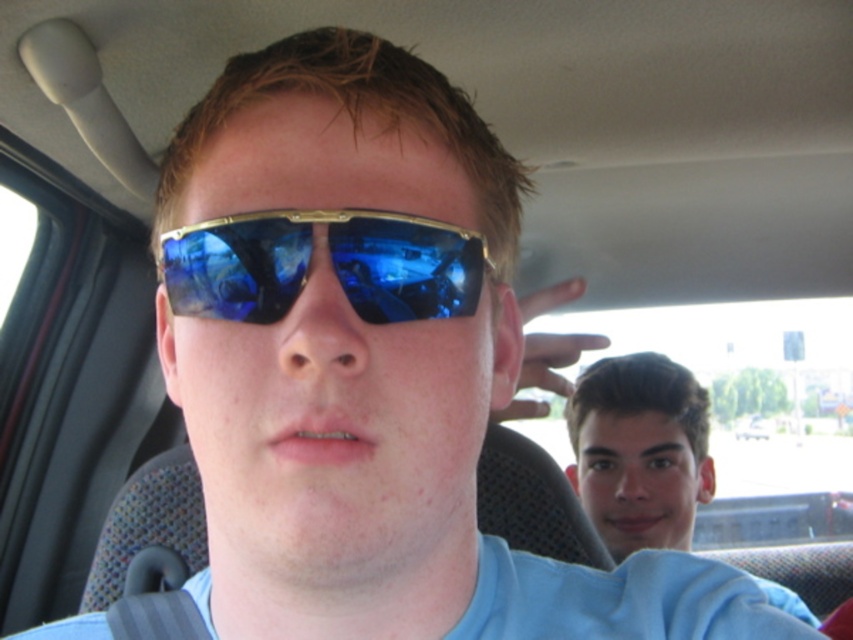
Is point (366, 278) more distant than point (616, 502)?

No.

Which is behind, point (206, 232) or point (601, 384)?

The point (601, 384) is behind.

Is point (268, 212) behind point (654, 522)?

No, it is in front of (654, 522).

The width and height of the screenshot is (853, 640). In order to click on blue reflective lens at center in this screenshot , I will do `click(331, 260)`.